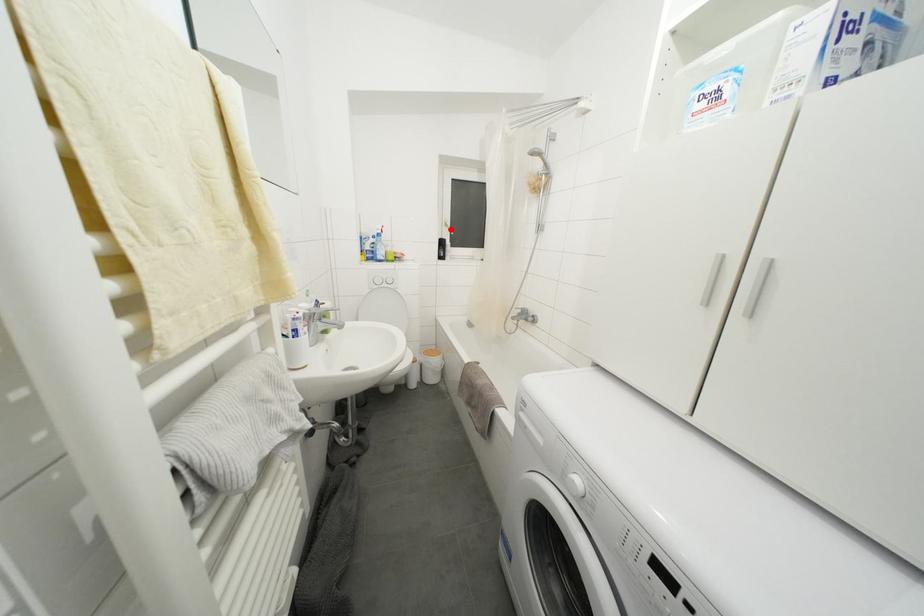
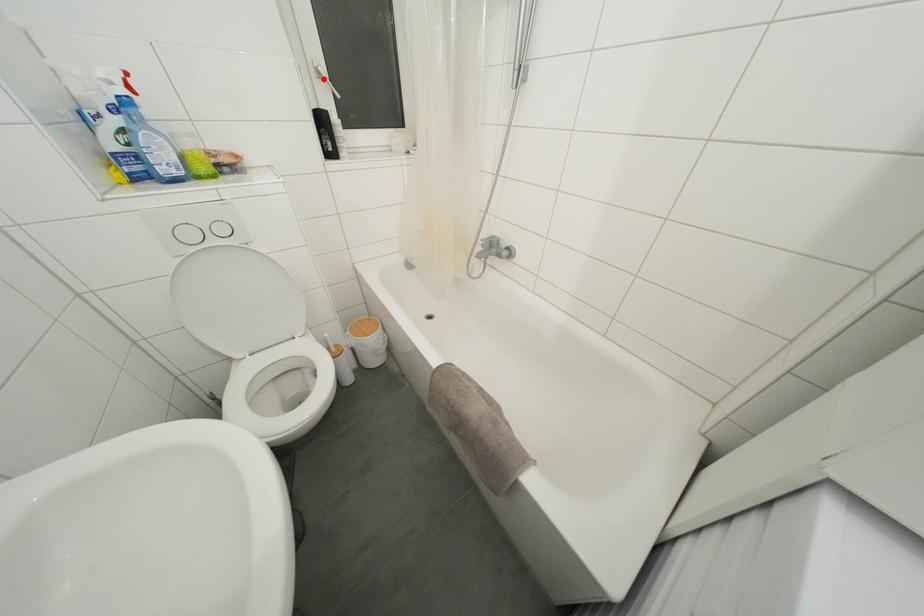
I am providing you with two images of the same scene from different viewpoints. A red point is marked on the first image and another point is marked on the second image. Is the red point in image1 aligned with the point shown in image2?

Yes